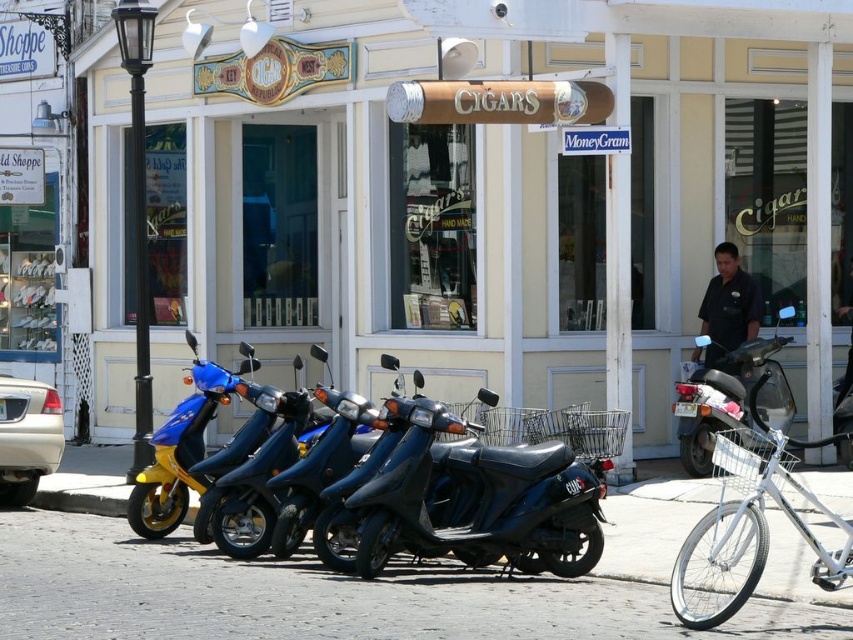
Question: Is shiny black scooter at center smaller than metallic blue scooter at center?

Choices:
 (A) yes
 (B) no

Answer: (B)

Question: Observing the image, what is the correct spatial positioning of matte blue scooters at center in reference to metallic blue scooter at center?

Choices:
 (A) above
 (B) below

Answer: (A)

Question: Which object is positioned closest to the white metallic bicycle at lower right?

Choices:
 (A) cobblestone pavement at center
 (B) shiny black scooter at center
 (C) metallic blue scooter at center

Answer: (B)

Question: Can you confirm if cobblestone pavement at center is positioned to the left of shiny black scooter at center?

Choices:
 (A) no
 (B) yes

Answer: (B)

Question: Which of these objects is positioned farthest from the metallic blue scooter at center?

Choices:
 (A) white metallic bicycle at lower right
 (B) cobblestone pavement at center
 (C) shiny black scooter at center

Answer: (A)

Question: Which is farther from the matte blue scooter at center?

Choices:
 (A) shiny black scooter at center
 (B) cobblestone pavement at center
 (C) matte blue scooters at center

Answer: (C)